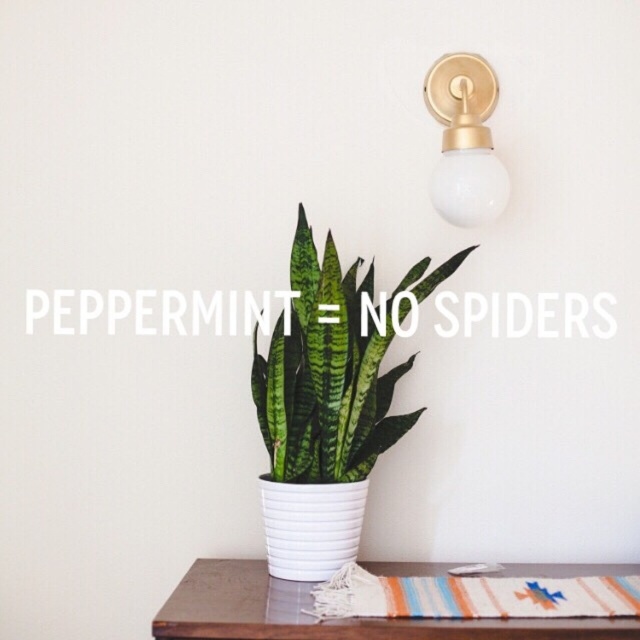
Question: Which object is farther from the camera taking this photo?

Choices:
 (A) brown wooden table at lower center
 (B) gold/brass/textured wall sconce at upper right

Answer: (B)

Question: Which point is farther to the camera?

Choices:
 (A) (451, 100)
 (B) (275, 632)
 (C) (292, 342)

Answer: (A)

Question: Among these points, which one is farthest from the camera?

Choices:
 (A) (456, 211)
 (B) (499, 577)

Answer: (A)

Question: Is green glossy snake plant at center positioned in front of brown wooden table at lower center?

Choices:
 (A) yes
 (B) no

Answer: (B)

Question: Is brown wooden table at lower center smaller than gold/brass/textured wall sconce at upper right?

Choices:
 (A) yes
 (B) no

Answer: (B)

Question: Is brown wooden table at lower center wider than gold/brass/textured wall sconce at upper right?

Choices:
 (A) no
 (B) yes

Answer: (B)